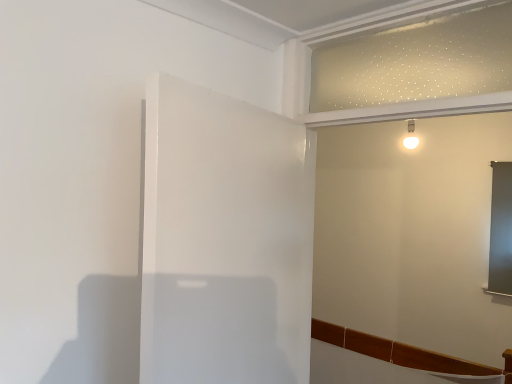
Question: From a real-world perspective, is matte white wall at upper center over white glossy door at center?

Choices:
 (A) yes
 (B) no

Answer: (A)

Question: Can you confirm if matte white wall at upper center is thinner than white glossy door at center?

Choices:
 (A) yes
 (B) no

Answer: (B)

Question: Is matte white wall at upper center positioned before white glossy door at center?

Choices:
 (A) no
 (B) yes

Answer: (A)

Question: Is matte white wall at upper center taller than white glossy door at center?

Choices:
 (A) yes
 (B) no

Answer: (A)

Question: Is matte white wall at upper center shorter than white glossy door at center?

Choices:
 (A) no
 (B) yes

Answer: (A)

Question: From the image's perspective, is matte white wall at upper center over white glossy door at center?

Choices:
 (A) no
 (B) yes

Answer: (B)

Question: Is the depth of white glossy door at center less than that of matte white wall at upper center?

Choices:
 (A) no
 (B) yes

Answer: (B)

Question: Is white glossy door at center turned away from matte white wall at upper center?

Choices:
 (A) yes
 (B) no

Answer: (B)

Question: Is white glossy door at center completely or partially outside of matte white wall at upper center?

Choices:
 (A) no
 (B) yes

Answer: (B)

Question: Is white glossy door at center not close to matte white wall at upper center?

Choices:
 (A) no
 (B) yes

Answer: (B)

Question: From a real-world perspective, is white glossy door at center located higher than matte white wall at upper center?

Choices:
 (A) yes
 (B) no

Answer: (B)

Question: Does white glossy door at center turn towards matte white wall at upper center?

Choices:
 (A) yes
 (B) no

Answer: (A)

Question: Is white glossy door at center in front of or behind matte white wall at upper center in the image?

Choices:
 (A) behind
 (B) front

Answer: (B)